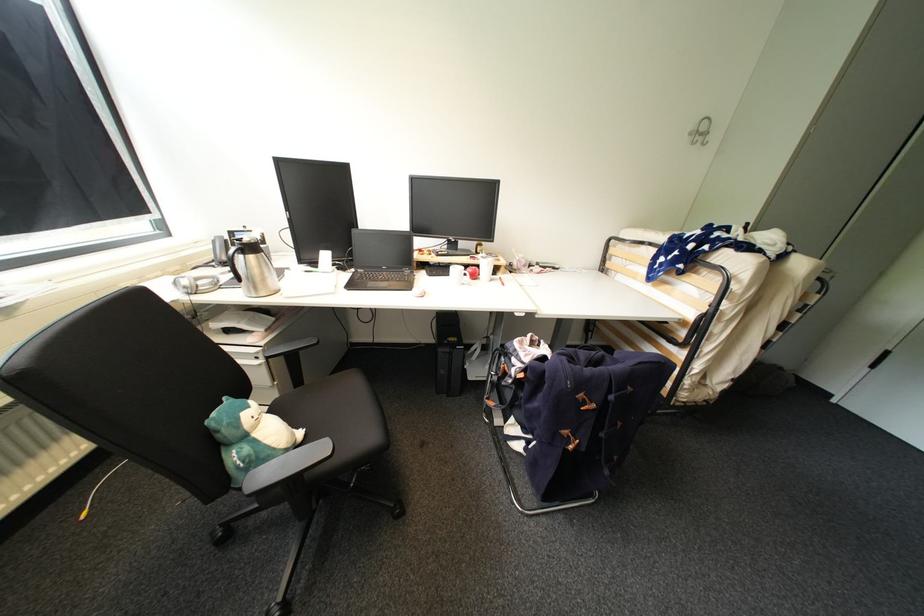
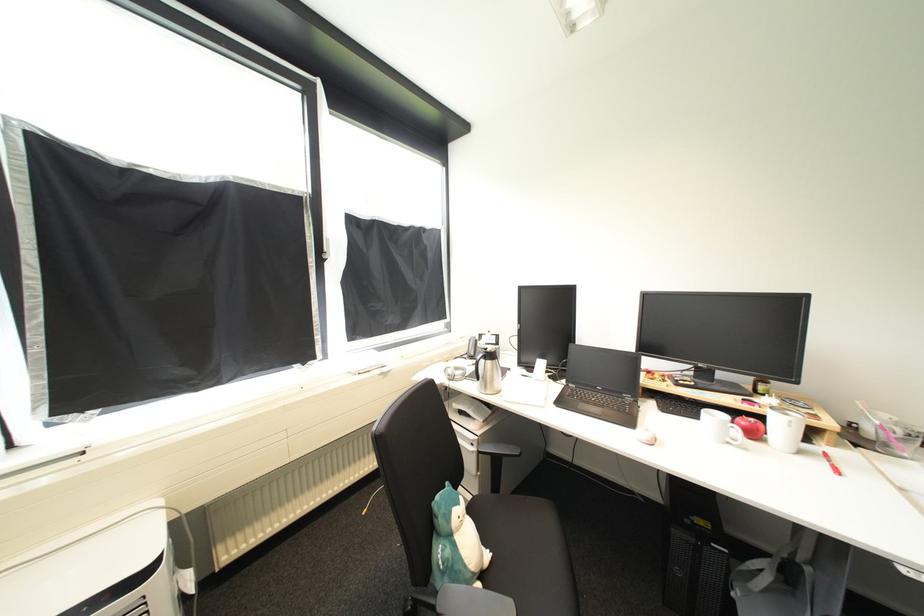
Locate, in the second image, the point that corresponds to point (261, 436) in the first image.

(464, 538)